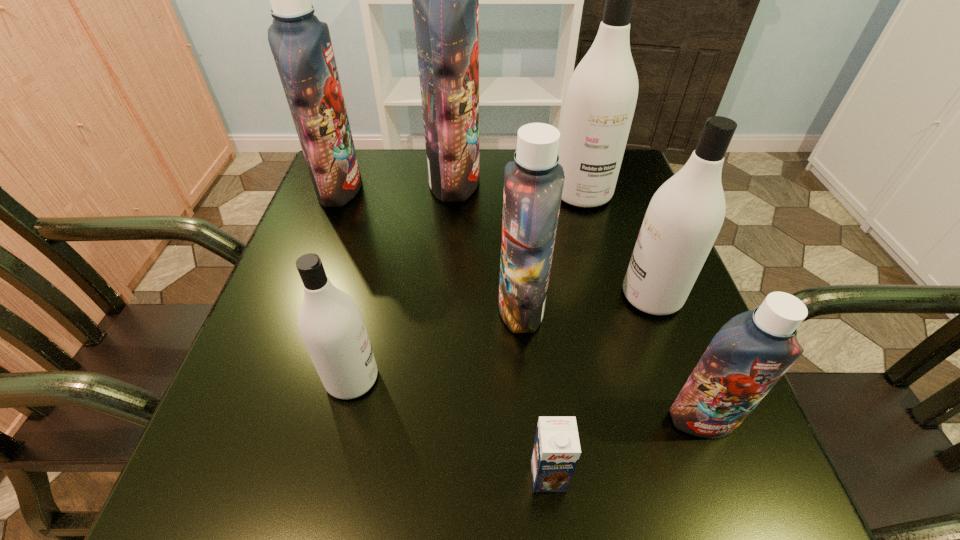
In the image, there is a desktop. Where is `vacant space at the left edge`? Image resolution: width=960 pixels, height=540 pixels. vacant space at the left edge is located at coordinates (330, 239).

You are a GUI agent. You are given a task and a screenshot of the screen. Output one action in this format:
    pyautogui.click(x=<x>, y=<y>)
    Task: Click on the free spot at the right edge of the desktop
    This screenshot has height=540, width=960.
    Given the screenshot: What is the action you would take?
    pyautogui.click(x=611, y=202)

The width and height of the screenshot is (960, 540). In the image, there is a desktop. What are the coordinates of `free space at the far right corner` in the screenshot? It's located at (619, 192).

The image size is (960, 540). Identify the location of free space between the biggest blue shampoo and the nearest object. (501, 328).

The height and width of the screenshot is (540, 960). Identify the location of vacant space that's between the biggest blue shampoo and the smallest blue shampoo. (579, 300).

This screenshot has width=960, height=540. I want to click on free point between the second smallest white shampoo and the nearest blue shampoo, so click(677, 357).

This screenshot has height=540, width=960. In order to click on vacant area that lies between the nearest object and the biggest white shampoo in this screenshot , I will do click(565, 335).

Where is `blank region between the second smallest white shampoo and the leftmost shampoo`? Image resolution: width=960 pixels, height=540 pixels. blank region between the second smallest white shampoo and the leftmost shampoo is located at coordinates (495, 242).

Locate an element on the screen. free area in between the second farthest white shampoo and the smallest white shampoo is located at coordinates (502, 337).

Identify the location of object that can be found as the sixth closest to the nearest object. (445, 0).